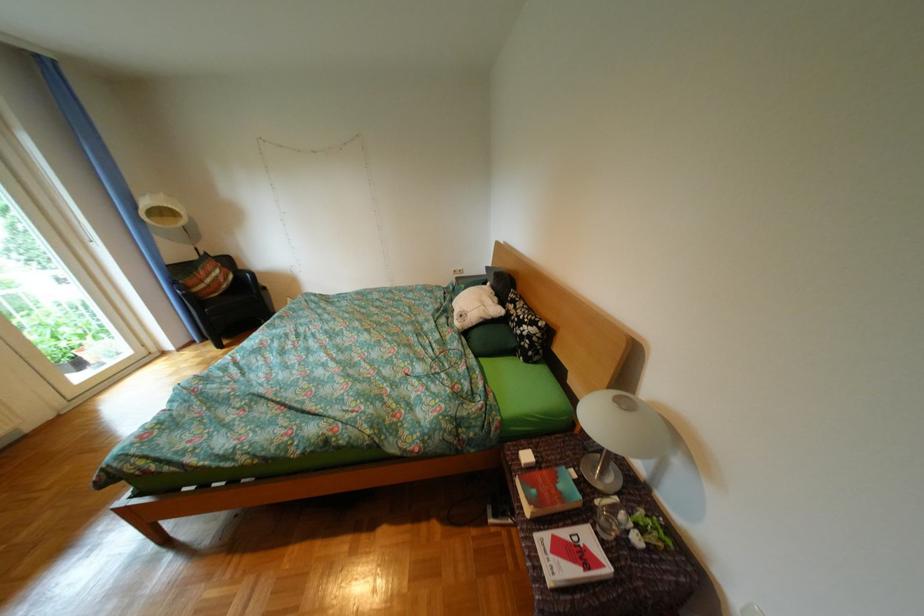
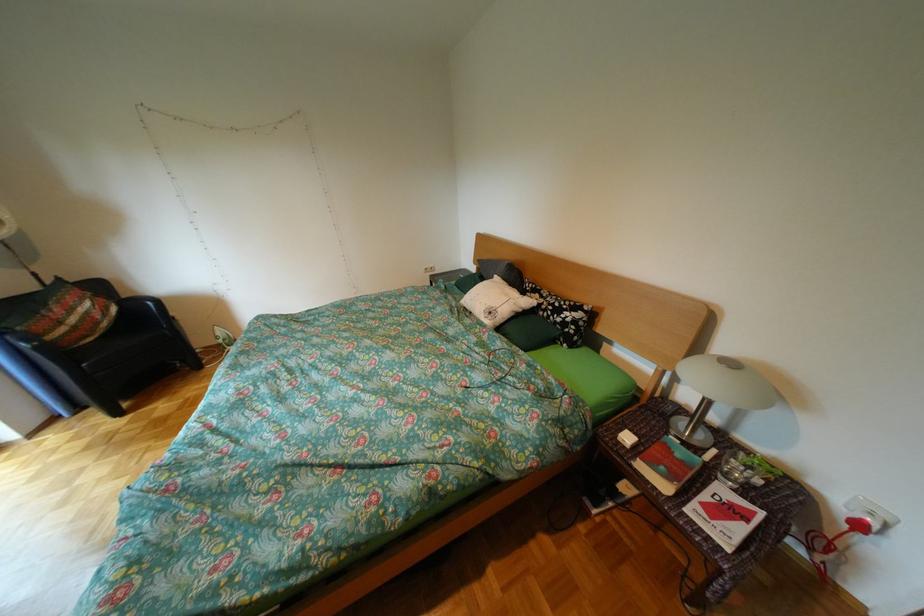
Question: The camera is either moving clockwise (left) or counter-clockwise (right) around the object. The first image is from the beginning of the video and the second image is from the end. Is the camera moving left or right when shooting the video?

Choices:
 (A) Left
 (B) Right

Answer: (A)